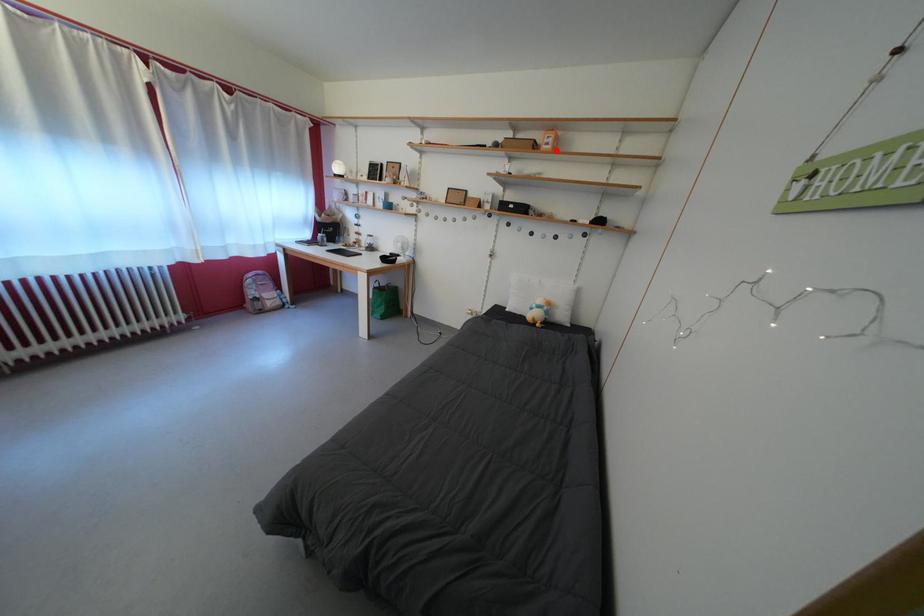
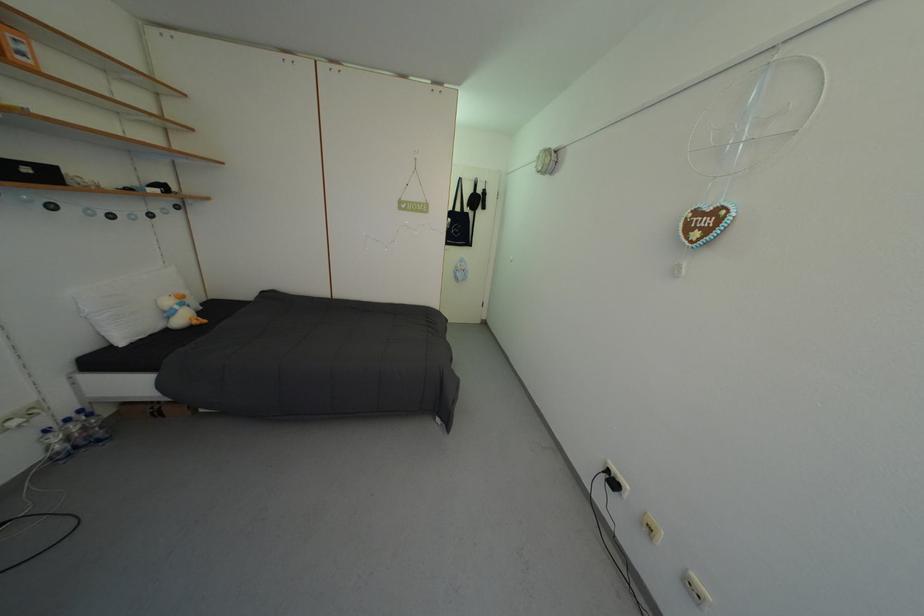
Question: I am providing you with two images of the same scene from different viewpoints. Image1 has a red point marked. In image2, the corresponding 3D location appears at what relative position? Reply with the corresponding letter.

Choices:
 (A) Closer
 (B) Farther

Answer: (B)